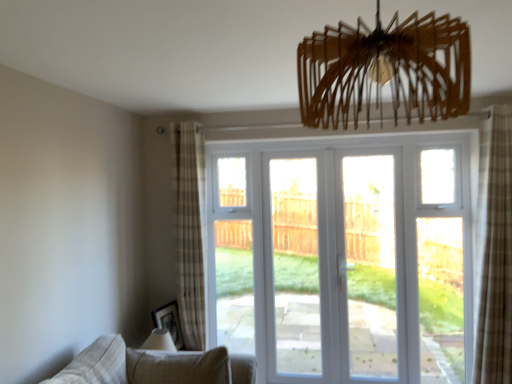
What are the coordinates of `beige fabric couch at lower left` in the screenshot? It's located at (151, 366).

The height and width of the screenshot is (384, 512). What do you see at coordinates (169, 322) in the screenshot?
I see `matte black picture frame at lower left` at bounding box center [169, 322].

This screenshot has width=512, height=384. In order to click on plaid fabric curtain at left, the 2th curtain positioned from the front in this screenshot , I will do `click(190, 231)`.

Are plaid fabric curtain at left, the 2th curtain positioned from the front, and white glass door at center, the first screen door positioned from the left, making contact?

No.

Considering the relative positions of plaid fabric curtain at left, the 1th curtain viewed from the back, and white glass door at center, the first screen door positioned from the left, in the image provided, is plaid fabric curtain at left, the 1th curtain viewed from the back, to the left of white glass door at center, the first screen door positioned from the left, from the viewer's perspective?

Yes, plaid fabric curtain at left, the 1th curtain viewed from the back, is to the left of white glass door at center, the first screen door positioned from the left.

Considering the relative positions of plaid fabric curtain at left, placed as the second curtain when sorted from right to left, and white glass door at center, the first screen door positioned from the left, in the image provided, is plaid fabric curtain at left, placed as the second curtain when sorted from right to left, behind white glass door at center, the first screen door positioned from the left,?

→ That is False.

Is there a large distance between white glass door at center, the 2th screen door viewed from the right, and white glossy door at center, the first screen door from the right?

white glass door at center, the 2th screen door viewed from the right, is near white glossy door at center, the first screen door from the right, not far away.

Considering the positions of objects white glass door at center, the first screen door positioned from the left, and white glossy door at center, the first screen door from the right, in the image provided, who is more to the left, white glass door at center, the first screen door positioned from the left, or white glossy door at center, the first screen door from the right,?

white glass door at center, the first screen door positioned from the left, is more to the left.

From a real-world perspective, who is located lower, white glass door at center, the 2th screen door viewed from the right, or white glossy door at center, the first screen door from the right?

In real-world perspective, white glass door at center, the 2th screen door viewed from the right, is lower.

From the image's perspective, which is below, white glass door at center, the 2th screen door viewed from the right, or white glossy door at center, which is the second screen door in left-to-right order?

white glass door at center, the 2th screen door viewed from the right, from the image's perspective.

Does white glossy door at center appear on the right side of brown plaid curtain at right, which is the 1th curtain from right to left?

No.

From the image's perspective, is white glossy door at center under brown plaid curtain at right, arranged as the second curtain when viewed from the left?

Indeed, from the image's perspective, white glossy door at center is shown beneath brown plaid curtain at right, arranged as the second curtain when viewed from the left.

From a real-world perspective, which is physically below, white glossy door at center or brown plaid curtain at right, marked as the first curtain in a front-to-back arrangement?

In real-world perspective, white glossy door at center is lower.

Image resolution: width=512 pixels, height=384 pixels. In the image, there is a brown plaid curtain at right, arranged as the second curtain when viewed from the left. In order to click on door below it (from a real-world perspective) in this screenshot , I will do `click(343, 258)`.

Measure the distance between matte black picture frame at lower left and plaid fabric curtain at left, placed as the second curtain when sorted from right to left.

They are 42.52 centimeters apart.

Considering the sizes of objects matte black picture frame at lower left and plaid fabric curtain at left, the 1th curtain viewed from the back, in the image provided, who is shorter, matte black picture frame at lower left or plaid fabric curtain at left, the 1th curtain viewed from the back,?

matte black picture frame at lower left is shorter.

Would you say matte black picture frame at lower left is to the left or to the right of plaid fabric curtain at left, the 2th curtain positioned from the front, in the picture?

In the image, matte black picture frame at lower left appears on the left side of plaid fabric curtain at left, the 2th curtain positioned from the front.

From a real-world perspective, is brown plaid curtain at right, which is the 1th curtain from right to left, located higher than matte black picture frame at lower left?

Yes, from a real-world perspective, brown plaid curtain at right, which is the 1th curtain from right to left, is on top of matte black picture frame at lower left.

Is brown plaid curtain at right, which is the 1th curtain from right to left, taller or shorter than matte black picture frame at lower left?

brown plaid curtain at right, which is the 1th curtain from right to left, is taller than matte black picture frame at lower left.

Which object is thinner, brown plaid curtain at right, marked as the first curtain in a front-to-back arrangement, or matte black picture frame at lower left?

matte black picture frame at lower left.

Considering the relative positions of brown plaid curtain at right, marked as the first curtain in a front-to-back arrangement, and matte black picture frame at lower left in the image provided, is brown plaid curtain at right, marked as the first curtain in a front-to-back arrangement, to the right of matte black picture frame at lower left from the viewer's perspective?

Yes, brown plaid curtain at right, marked as the first curtain in a front-to-back arrangement, is to the right of matte black picture frame at lower left.

Considering the positions of objects white glossy door at center, which is the second screen door in left-to-right order, and beige fabric couch at lower left in the image provided, who is more to the right, white glossy door at center, which is the second screen door in left-to-right order, or beige fabric couch at lower left?

white glossy door at center, which is the second screen door in left-to-right order.

From the image's perspective, is white glossy door at center, which is the second screen door in left-to-right order, beneath beige fabric couch at lower left?

No, from the image's perspective, white glossy door at center, which is the second screen door in left-to-right order, is not beneath beige fabric couch at lower left.

Would you say beige fabric couch at lower left is part of white glossy door at center, the first screen door from the right,'s contents?

Actually, beige fabric couch at lower left is outside white glossy door at center, the first screen door from the right.

Does white glossy door at center, which is the second screen door in left-to-right order, have a greater height compared to beige fabric couch at lower left?

Yes, white glossy door at center, which is the second screen door in left-to-right order, is taller than beige fabric couch at lower left.

Find the location of a particular element. This screenshot has width=512, height=384. curtain that appears on the left of brown plaid curtain at right, marked as the first curtain in a front-to-back arrangement is located at coordinates (190, 231).

Is plaid fabric curtain at left, which is the first curtain in left-to-right order, thinner than brown plaid curtain at right, marked as the first curtain in a front-to-back arrangement?

Incorrect, the width of plaid fabric curtain at left, which is the first curtain in left-to-right order, is not less than that of brown plaid curtain at right, marked as the first curtain in a front-to-back arrangement.

Which of these two, plaid fabric curtain at left, which is the first curtain in left-to-right order, or brown plaid curtain at right, the 2th curtain positioned from the back, is smaller?

plaid fabric curtain at left, which is the first curtain in left-to-right order, is smaller.

The height and width of the screenshot is (384, 512). I want to click on the 1st curtain in front of the white glass door at center, the 2th screen door viewed from the right, starting your count from the anchor, so click(190, 231).

The width and height of the screenshot is (512, 384). Identify the location of screen door above the white glass door at center, the 2th screen door viewed from the right (from a real-world perspective). pyautogui.click(x=332, y=266).

Considering their positions, is white glossy door at center, the first screen door from the right, positioned further to white glass door at center, the 2th screen door viewed from the right, than white glossy door at center?

white glossy door at center.

In the scene shown: Based on their spatial positions, is matte black picture frame at lower left or white glossy door at center, the first screen door from the right, further from white glass door at center, the 2th screen door viewed from the right?

The object further to white glass door at center, the 2th screen door viewed from the right, is matte black picture frame at lower left.

Estimate the real-world distances between objects in this image. Which object is closer to wooden chandelier at upper center, white glossy door at center or white glossy door at center, which is the second screen door in left-to-right order?

white glossy door at center is positioned closer to the anchor wooden chandelier at upper center.

Considering their positions, is wooden chandelier at upper center positioned further to white glossy door at center than matte black picture frame at lower left?

wooden chandelier at upper center is positioned further to the anchor white glossy door at center.

Estimate the real-world distances between objects in this image. Which object is further from white glossy door at center, the first screen door from the right, brown plaid curtain at right, which is the 1th curtain from right to left, or white glass door at center, the first screen door positioned from the left?

brown plaid curtain at right, which is the 1th curtain from right to left, is further to white glossy door at center, the first screen door from the right.

Based on their spatial positions, is beige fabric couch at lower left or wooden chandelier at upper center closer to white glossy door at center, which is the second screen door in left-to-right order?

Among the two, beige fabric couch at lower left is located nearer to white glossy door at center, which is the second screen door in left-to-right order.

Looking at the image, which one is located further to wooden chandelier at upper center, white glossy door at center or plaid fabric curtain at left, the 2th curtain positioned from the front?

white glossy door at center lies further to wooden chandelier at upper center than the other object.

Considering their positions, is beige fabric couch at lower left positioned further to wooden chandelier at upper center than white glossy door at center?

white glossy door at center is further to wooden chandelier at upper center.

At what (x,y) coordinates should I click in order to perform the action: click on door between wooden chandelier at upper center and white glossy door at center, the first screen door from the right, in the front-back direction. Please return your answer as a coordinate pair (x, y). Looking at the image, I should click on (343, 258).

At what (x,y) coordinates should I click in order to perform the action: click on screen door between plaid fabric curtain at left, the 1th curtain viewed from the back, and white glossy door at center, in the horizontal direction. Please return your answer as a coordinate pair (x, y). Looking at the image, I should click on (295, 265).

Where is `door between beige fabric couch at lower left and white glossy door at center, the first screen door from the right`? This screenshot has height=384, width=512. door between beige fabric couch at lower left and white glossy door at center, the first screen door from the right is located at coordinates (343, 258).

Image resolution: width=512 pixels, height=384 pixels. What are the coordinates of `picture frame positioned between wooden chandelier at upper center and white glossy door at center from near to far` in the screenshot? It's located at (169, 322).